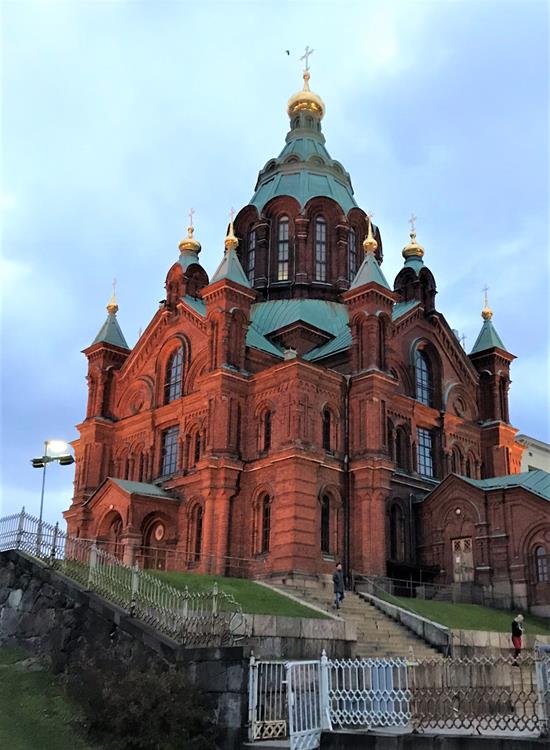
Identify the location of bottom windows. (x=266, y=523), (x=324, y=523), (x=394, y=537), (x=196, y=531), (x=75, y=543), (x=541, y=565).